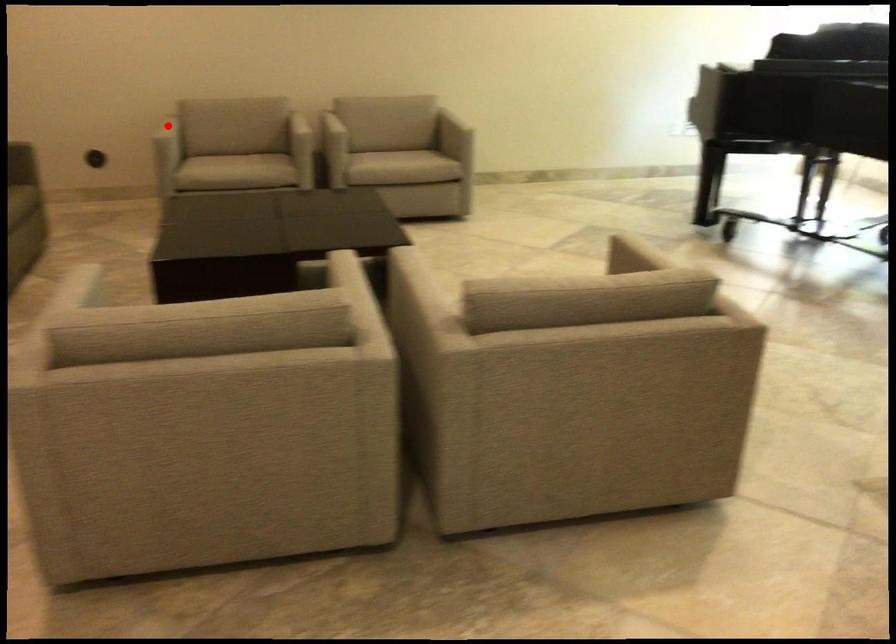
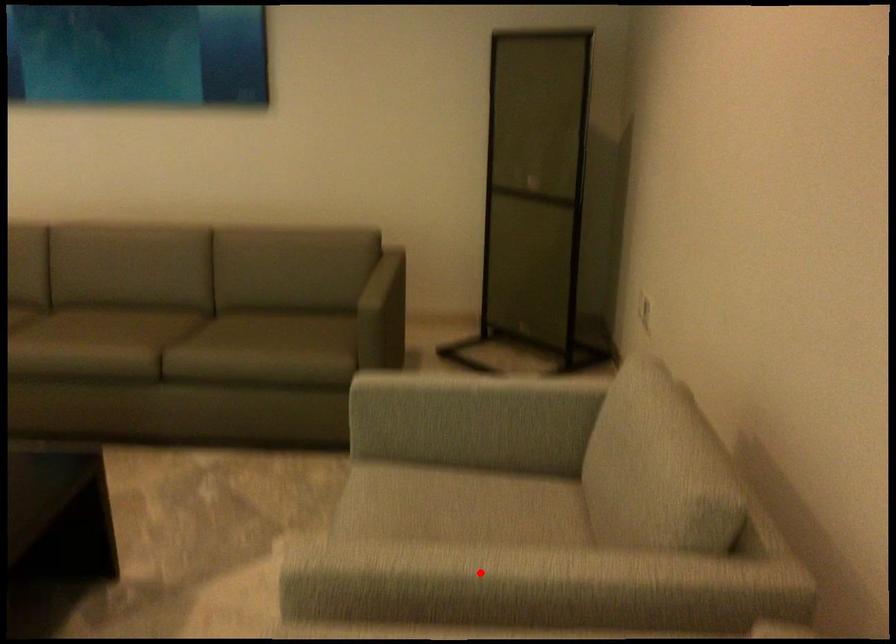
I am providing you with two images of the same scene from different viewpoints. A red point is marked on the first image and another point is marked on the second image. Are the points marked in image1 and image2 representing the same 3D position?

No